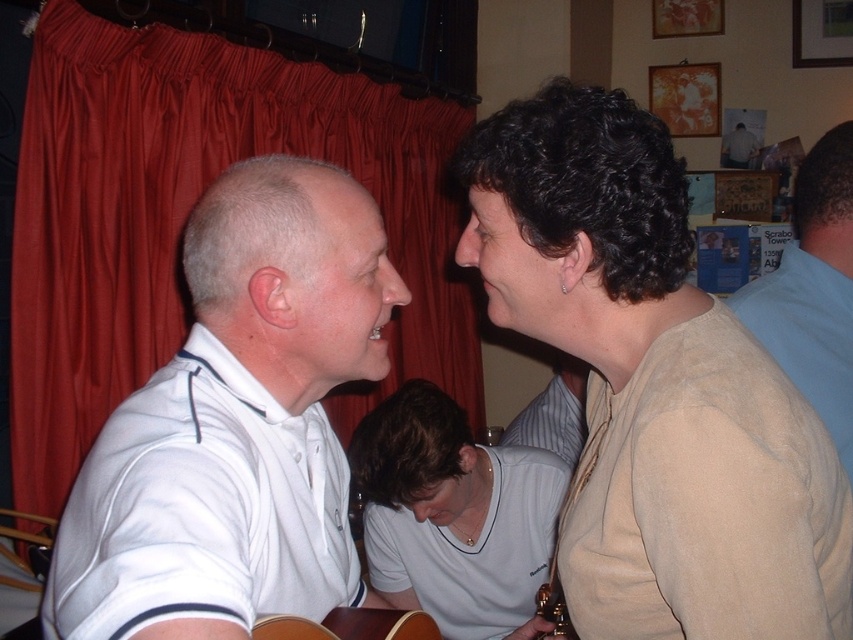
Question: Is beige soft sweater at upper right to the left of white matte shirt at left from the viewer's perspective?

Choices:
 (A) yes
 (B) no

Answer: (B)

Question: Does beige soft sweater at upper right appear under white matte shirt at left?

Choices:
 (A) no
 (B) yes

Answer: (A)

Question: Which of the following is the closest to the observer?

Choices:
 (A) light brown wooden guitar at center
 (B) white matte shirt at left

Answer: (B)

Question: Among these objects, which one is farthest from the camera?

Choices:
 (A) white matte shirt at left
 (B) blue cotton shirt at upper right

Answer: (B)

Question: Can you confirm if light brown wooden guitar at center is positioned below white shirt at upper center?

Choices:
 (A) yes
 (B) no

Answer: (A)

Question: Which object is farther from the camera taking this photo?

Choices:
 (A) white matte shirt at center
 (B) light brown wooden guitar at center
 (C) white matte shirt at left

Answer: (A)